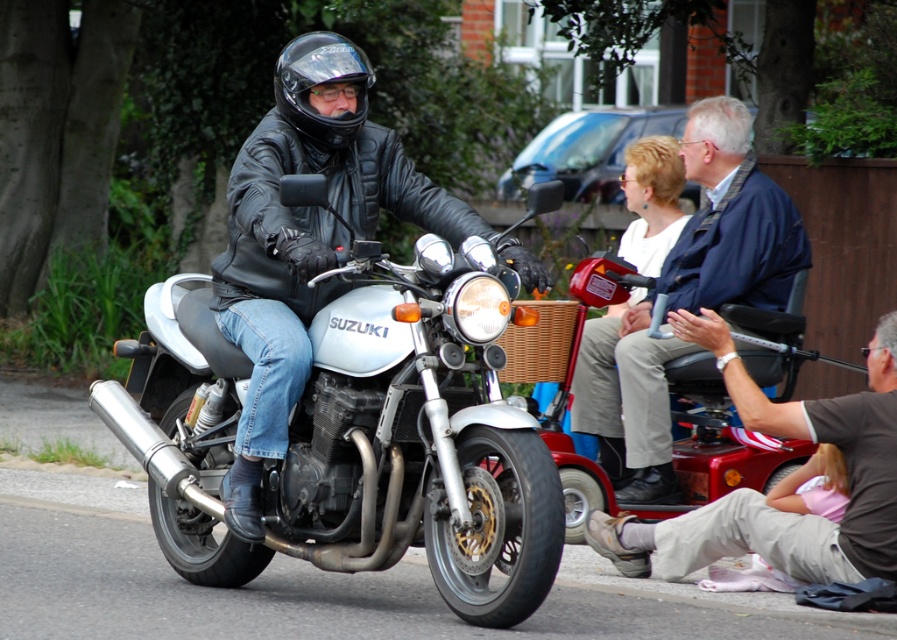
You are a delivery person who needs to load a package onto the silver metallic motorcycle at center. The package requires that it must be placed above the black matte helmet at center. Can you do this based on the scene?

The silver metallic motorcycle at center is taller than the black matte helmet at center, so yes, the package can be placed above the black matte helmet at center since the motorcycle has sufficient height.

You are standing at the camera position and want to take a photo of the silver metallic motorcycle at center. The camera has a maximum focus range of 8 meters. Will the motorcycle be in focus?

The silver metallic motorcycle at center is 8.68 meters away from camera, which exceeds the camera maximum focus range of 8 meters. Therefore, the motorcycle will not be in focus.

You are a delivery person who needs to park your vehicle between the silver metallic motorcycle at center and the brown leather jacket at lower right. The space available is exactly 1.2 meters wide. Can your vehicle fit if it requires 1.1 meters of width?

The silver metallic motorcycle at center might be wider than brown leather jacket at lower right. If the motorcycle is wider than 1.1 meters, then the vehicle cannot fit. However, if the motorcycle is narrower than 1.1 meters, it can fit. The exact width is not provided, so we cannot confirm for certain.